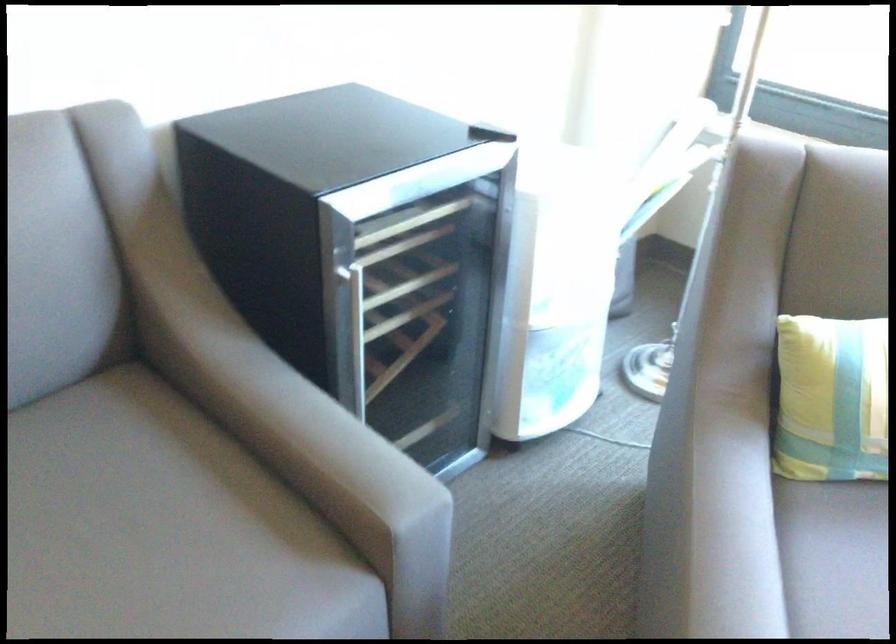
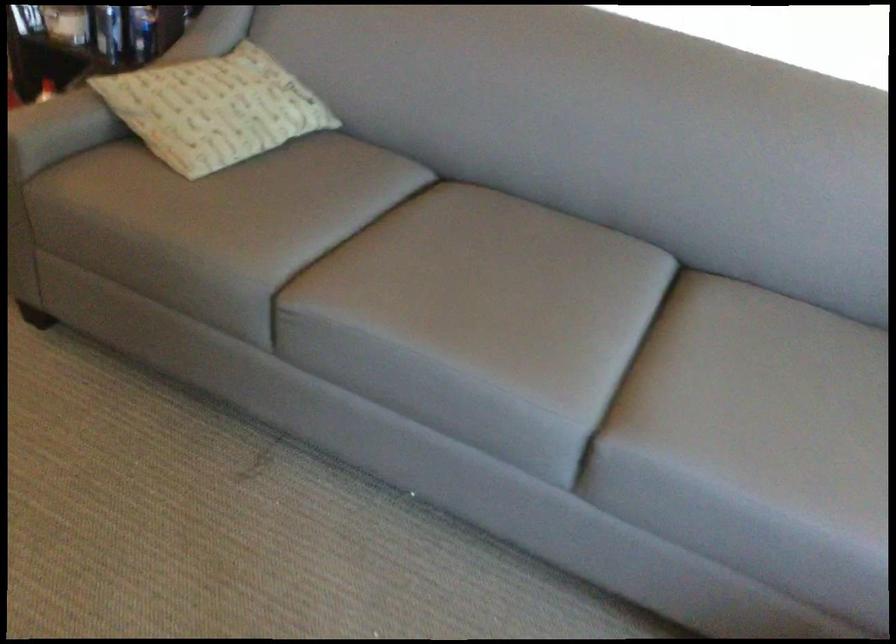
Question: How did the camera likely rotate?

Choices:
 (A) Left
 (B) Right
 (C) Up
 (D) Down

Answer: (A)